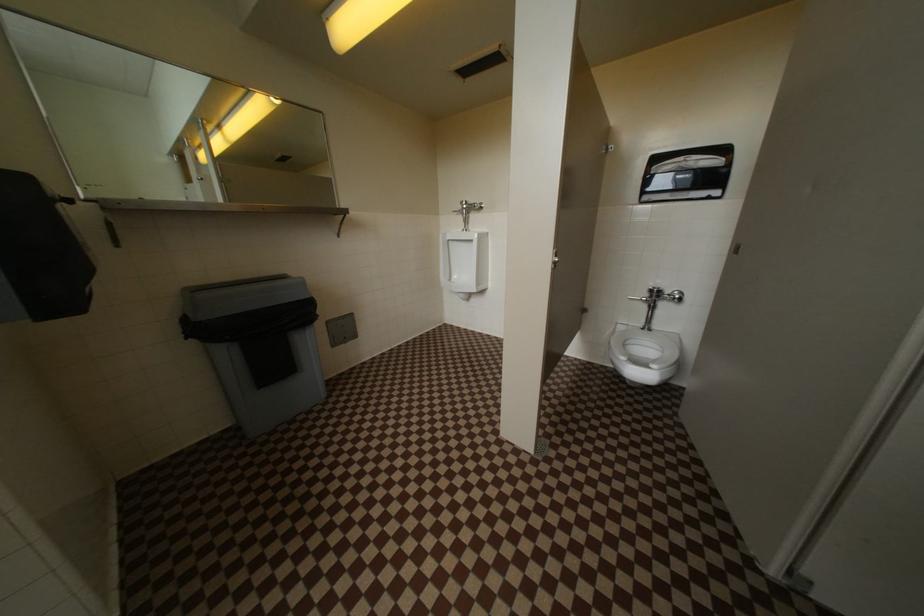
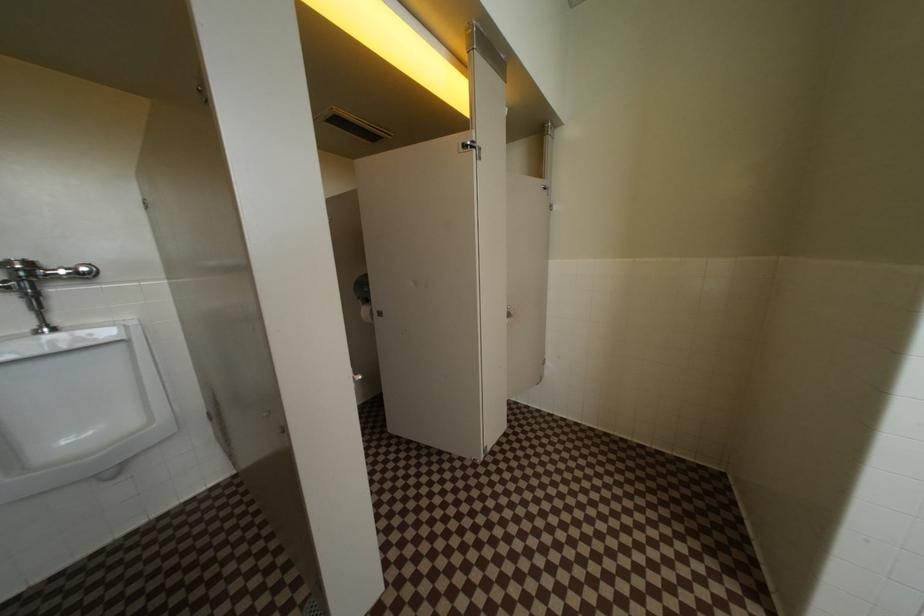
Question: The camera is either moving clockwise (left) or counter-clockwise (right) around the object. The first image is from the beginning of the video and the second image is from the end. Is the camera moving left or right when shooting the video?

Choices:
 (A) Left
 (B) Right

Answer: (A)